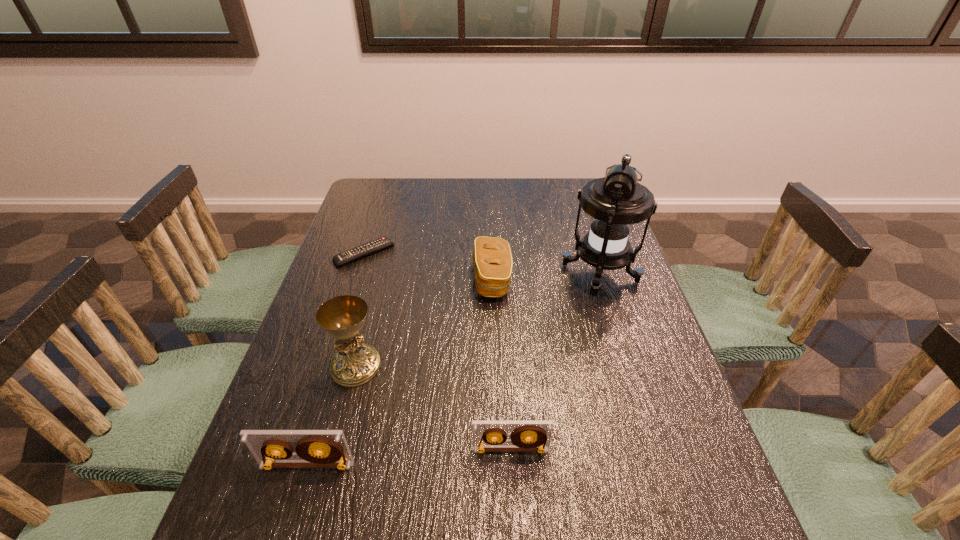
Locate an element on the screen. The height and width of the screenshot is (540, 960). the nearest object is located at coordinates (316, 448).

The image size is (960, 540). What are the coordinates of `the left videotape` in the screenshot? It's located at (316, 448).

Locate an element on the screen. The width and height of the screenshot is (960, 540). the farther videotape is located at coordinates (487, 436).

Where is `the right videotape`? The height and width of the screenshot is (540, 960). the right videotape is located at coordinates (487, 436).

I want to click on clutch bag, so click(x=492, y=260).

Identify the location of the tallest object. The height and width of the screenshot is (540, 960). (615, 202).

Where is `the rightmost object`? The height and width of the screenshot is (540, 960). the rightmost object is located at coordinates (615, 202).

Find the location of a particular element. The width and height of the screenshot is (960, 540). the shortest object is located at coordinates (373, 246).

This screenshot has width=960, height=540. I want to click on the third nearest object, so click(x=355, y=363).

I want to click on the second tallest object, so click(x=355, y=363).